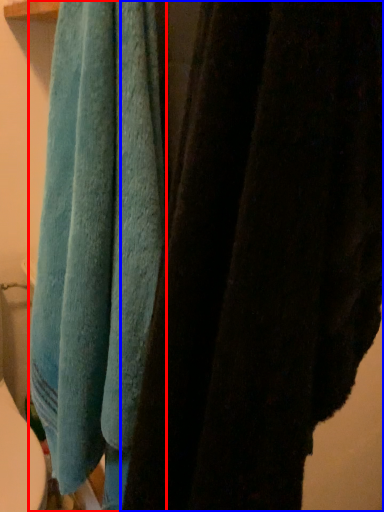
Question: Among these objects, which one is farthest to the camera, towel (highlighted by a red box) or towel (highlighted by a blue box)?

Choices:
 (A) towel
 (B) towel

Answer: (A)